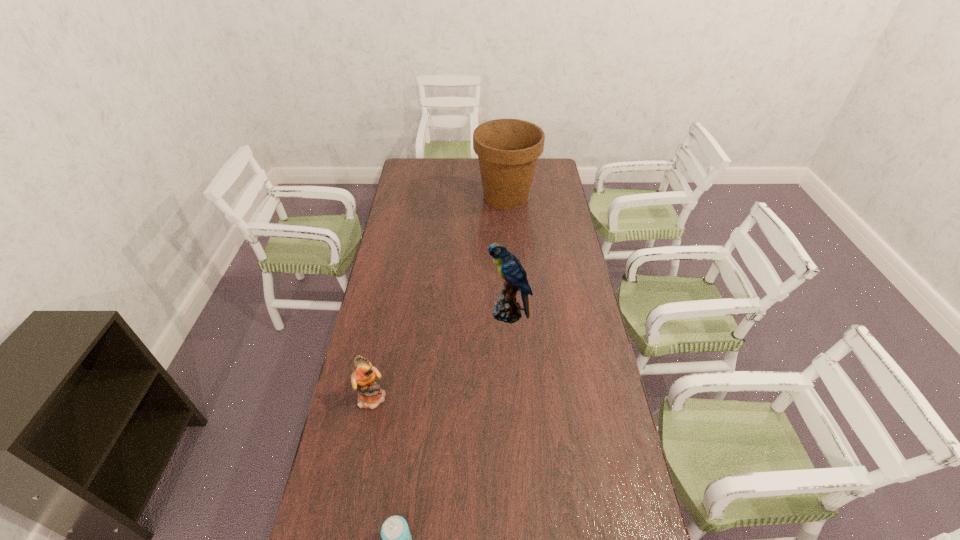
Find the location of a particular element. flowerpot is located at coordinates (508, 149).

Identify the location of the taller parrot. This screenshot has width=960, height=540. coord(507,310).

This screenshot has width=960, height=540. I want to click on the right parrot, so click(507, 310).

Find the location of `the leftmost object`. the leftmost object is located at coordinates tap(370, 395).

This screenshot has width=960, height=540. Identify the location of the third farthest object. (370, 395).

The height and width of the screenshot is (540, 960). In order to click on vacant space situated on the back of the farthest object in this screenshot , I will do `click(504, 175)`.

At what (x,y) coordinates should I click in order to perform the action: click on vacant space situated 0.380m on the face of the right parrot. Please return your answer as a coordinate pair (x, y). The image size is (960, 540). Looking at the image, I should click on (390, 313).

At what (x,y) coordinates should I click in order to perform the action: click on vacant region located 0.080m on the face of the right parrot. Please return your answer as a coordinate pair (x, y). Looking at the image, I should click on (467, 313).

Locate an element on the screen. free space located 0.180m on the face of the right parrot is located at coordinates (442, 313).

Locate an element on the screen. The image size is (960, 540). vacant space situated 0.370m on the front-facing side of the shorter parrot is located at coordinates (500, 397).